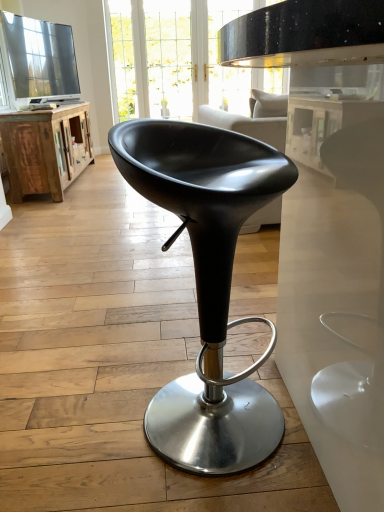
Based on the photo, measure the distance between point (176, 198) and camera.

They are 29.25 inches apart.

Identify the location of clear glass door at upper center. (121, 59).

The image size is (384, 512). I want to click on black leather stool at center, so click(207, 284).

Considering the relative positions of rustic wood cabinet at left and black leather stool at center in the image provided, is rustic wood cabinet at left in front of black leather stool at center?

No, the depth of rustic wood cabinet at left is greater than that of black leather stool at center.

Considering the sizes of rustic wood cabinet at left and black leather stool at center in the image, is rustic wood cabinet at left taller or shorter than black leather stool at center?

In the image, rustic wood cabinet at left appears to be shorter than black leather stool at center.

Is rustic wood cabinet at left situated inside black leather stool at center or outside?

rustic wood cabinet at left is not inside black leather stool at center, it's outside.

Considering the positions of objects rustic wood cabinet at left and black leather stool at center in the image provided, who is more to the left, rustic wood cabinet at left or black leather stool at center?

Positioned to the left is rustic wood cabinet at left.

Considering the sizes of objects clear glass door at upper center and black leather stool at center in the image provided, who is thinner, clear glass door at upper center or black leather stool at center?

clear glass door at upper center is thinner.

Is the position of clear glass door at upper center less distant than that of black leather stool at center?

No, clear glass door at upper center is further to the viewer.

Is clear glass door at upper center to the left of black leather stool at center from the viewer's perspective?

Correct, you'll find clear glass door at upper center to the left of black leather stool at center.

From the image's perspective, between black leather stool at center and clear glass door at upper center, who is located below?

black leather stool at center is shown below in the image.

Can we say black leather stool at center lies outside clear glass door at upper center?

black leather stool at center is positioned outside clear glass door at upper center.

Between black leather stool at center and clear glass door at upper center, which one has larger size?

With larger size is black leather stool at center.

Which is less distant, (236,232) or (123,90)?

Point (236,232)

Is black leather stool at center wider than rustic wood cabinet at left?

In fact, black leather stool at center might be narrower than rustic wood cabinet at left.

Would you say black leather stool at center is inside or outside rustic wood cabinet at left?

black leather stool at center is not enclosed by rustic wood cabinet at left.

Does black leather stool at center lie in front of rustic wood cabinet at left?

Yes, it is.

Which is more to the right, black leather stool at center or rustic wood cabinet at left?

black leather stool at center is more to the right.

From a real-world perspective, which object stands above the other?

clear glass door at upper center is physically above.

Based on the photo, is clear glass door at upper center turned away from rustic wood cabinet at left?

No.

Is the surface of clear glass door at upper center in direct contact with rustic wood cabinet at left?

No.

Which is behind, point (105, 17) or point (1, 138)?

Positioned behind is point (105, 17).

Image resolution: width=384 pixels, height=512 pixels. What are the coordinates of `table below the clear glass door at upper center (from a real-world perspective)` in the screenshot? It's located at (46, 149).

Relative to clear glass door at upper center, is rustic wood cabinet at left in front or behind?

Clearly, rustic wood cabinet at left is in front of clear glass door at upper center.

Is rustic wood cabinet at left taller or shorter than clear glass door at upper center?

rustic wood cabinet at left is shorter than clear glass door at upper center.

From the picture: Would you say rustic wood cabinet at left is to the left or to the right of clear glass door at upper center in the picture?

Clearly, rustic wood cabinet at left is on the left of clear glass door at upper center in the image.

Identify the location of chair in front of the rustic wood cabinet at left. The height and width of the screenshot is (512, 384). (207, 284).

Find the location of a particular element. The height and width of the screenshot is (512, 384). glass door behind the black leather stool at center is located at coordinates (121, 59).

Based on their spatial positions, is rustic wood cabinet at left or clear glass door at upper center closer to black leather stool at center?

Among the two, rustic wood cabinet at left is located nearer to black leather stool at center.

Looking at the image, which one is located further to clear glass door at upper center, black leather stool at center or rustic wood cabinet at left?

Among the two, black leather stool at center is located further to clear glass door at upper center.

Considering their positions, is clear glass door at upper center positioned closer to black leather stool at center than rustic wood cabinet at left?

rustic wood cabinet at left.

Looking at the image, which one is located further to clear glass door at upper center, rustic wood cabinet at left or black leather stool at center?

Among the two, black leather stool at center is located further to clear glass door at upper center.

From the image, which object appears to be farther from rustic wood cabinet at left, clear glass door at upper center or black leather stool at center?

Among the two, black leather stool at center is located further to rustic wood cabinet at left.

Estimate the real-world distances between objects in this image. Which object is closer to rustic wood cabinet at left, black leather stool at center or clear glass door at upper center?

clear glass door at upper center lies closer to rustic wood cabinet at left than the other object.

You are a GUI agent. You are given a task and a screenshot of the screen. Output one action in this format:
    pyautogui.click(x=<x>, y=<y>)
    Task: Click on the table between black leather stool at center and clear glass door at upper center from front to back
    The height and width of the screenshot is (512, 384).
    Given the screenshot: What is the action you would take?
    pyautogui.click(x=46, y=149)